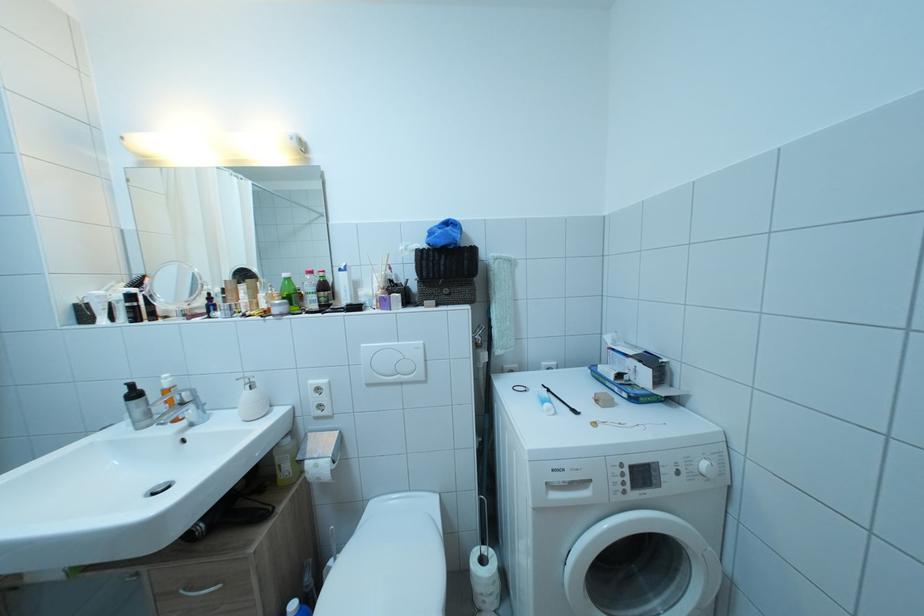
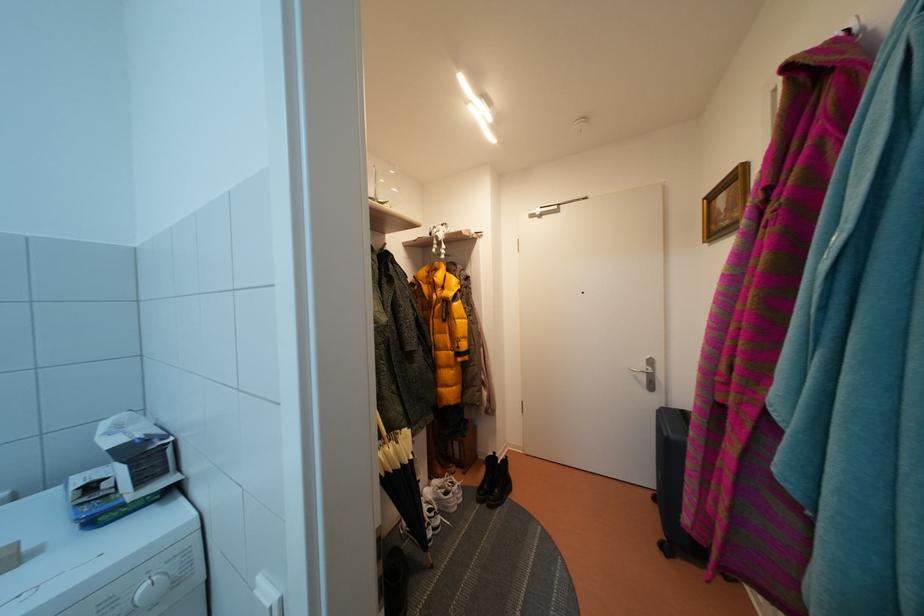
Question: Based on the continuous images, in which direction is the camera rotating? Reply with the corresponding letter.

Choices:
 (A) Left
 (B) Right
 (C) Up
 (D) Down

Answer: (B)